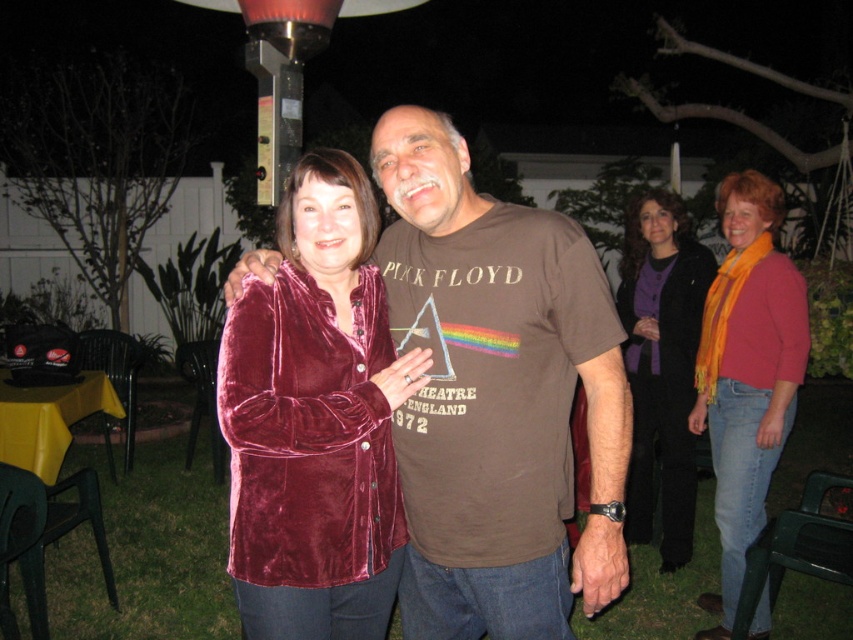
Question: Where is velvet maroon jacket at center located in relation to purple velvet scarf at upper right in the image?

Choices:
 (A) below
 (B) above

Answer: (B)

Question: Is brown cotton t-shirt at center wider than velvet maroon jacket at center?

Choices:
 (A) yes
 (B) no

Answer: (A)

Question: Which object is closer to the camera taking this photo?

Choices:
 (A) purple velvet scarf at upper right
 (B) velvet maroon jacket at center
 (C) brown cotton t-shirt at center
 (D) velvet burgundy coat at center

Answer: (B)

Question: Is velvet burgundy coat at center closer to camera compared to purple velvet scarf at upper right?

Choices:
 (A) no
 (B) yes

Answer: (B)

Question: Which point is closer to the camera taking this photo?

Choices:
 (A) (456, 497)
 (B) (711, 598)
 (C) (341, 547)
 (D) (659, 365)

Answer: (C)

Question: Which point is farther to the camera?

Choices:
 (A) (755, 308)
 (B) (465, 177)

Answer: (A)